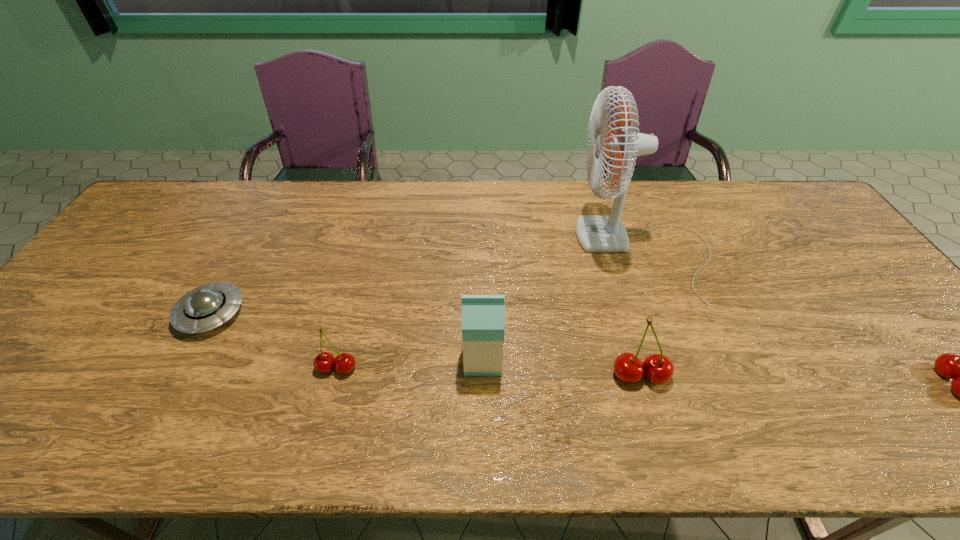
I want to click on vacant place for an extra cherry on the left, so click(42, 361).